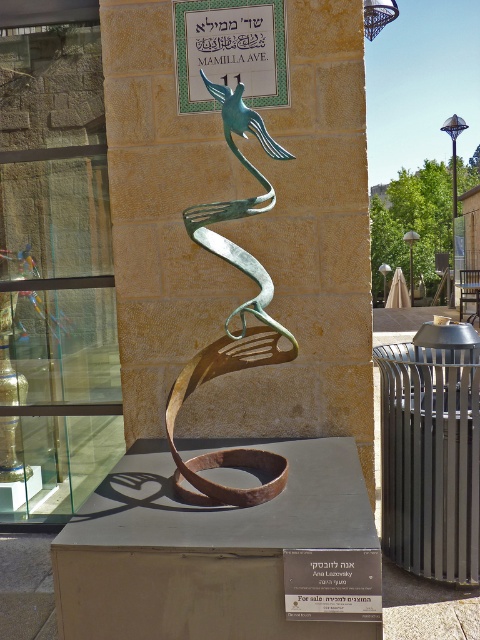
Which is more to the left, green patina metal bird at center or green metallic sign at upper center?

Positioned to the left is green metallic sign at upper center.

You are a GUI agent. You are given a task and a screenshot of the screen. Output one action in this format:
    pyautogui.click(x=<x>, y=<y>)
    Task: Click on the green patina metal bird at center
    Image resolution: width=480 pixels, height=640 pixels.
    Given the screenshot: What is the action you would take?
    pyautogui.click(x=240, y=209)